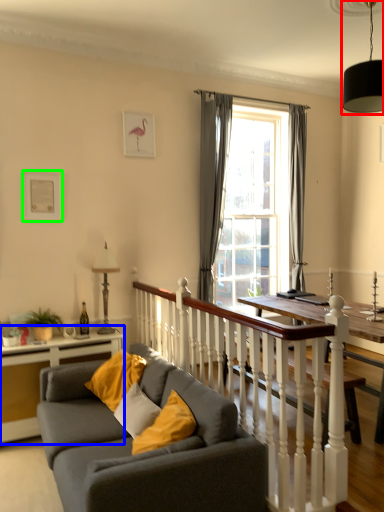
Question: Based on their relative distances, which object is nearer to light fixture (highlighted by a red box)? Choose from table (highlighted by a blue box) and picture frame (highlighted by a green box).

Choices:
 (A) table
 (B) picture frame

Answer: (B)